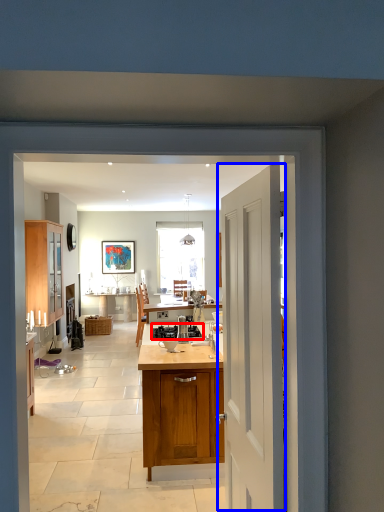
Question: Which of the following is the farthest to the observer, gas stove (highlighted by a red box) or door (highlighted by a blue box)?

Choices:
 (A) gas stove
 (B) door

Answer: (A)